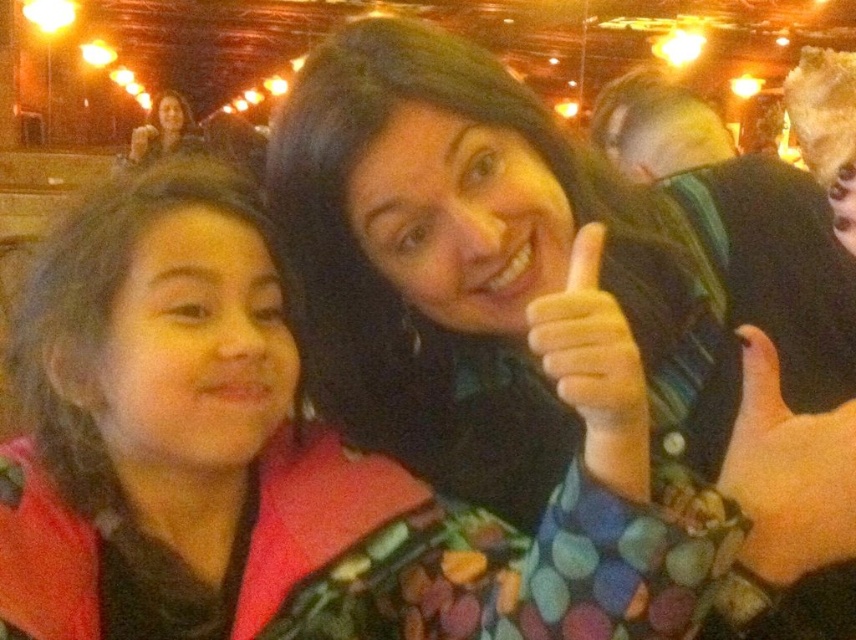
Is matte black hand at upper center wider than matte black hair at upper left?

No.

Does point (628, 397) lie in front of point (186, 129)?

Yes.

What are the coordinates of `matte black hand at upper center` in the screenshot? It's located at point(589,342).

Who is more distant from viewer, (738, 291) or (575, 340)?

The point (738, 291) is more distant.

Is green striped sweater at upper right to the right of matte black hand at upper center from the viewer's perspective?

Correct, you'll find green striped sweater at upper right to the right of matte black hand at upper center.

The image size is (856, 640). In order to click on green striped sweater at upper right in this screenshot , I will do pyautogui.click(x=745, y=228).

Which is above, pink matte hand at upper right or matte black hand at upper center?

matte black hand at upper center is above.

Between pink matte hand at upper right and matte black hand at upper center, which one appears on the right side from the viewer's perspective?

Positioned to the right is pink matte hand at upper right.

Which is in front, point (805, 419) or point (632, 337)?

Positioned in front is point (805, 419).

Where is `pink matte hand at upper right`? The height and width of the screenshot is (640, 856). pink matte hand at upper right is located at coordinates (788, 474).